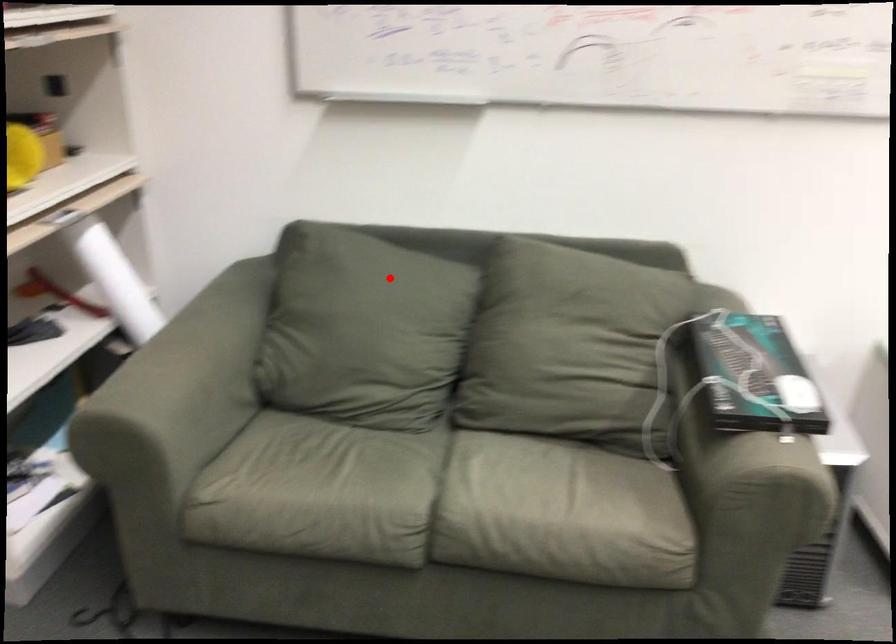
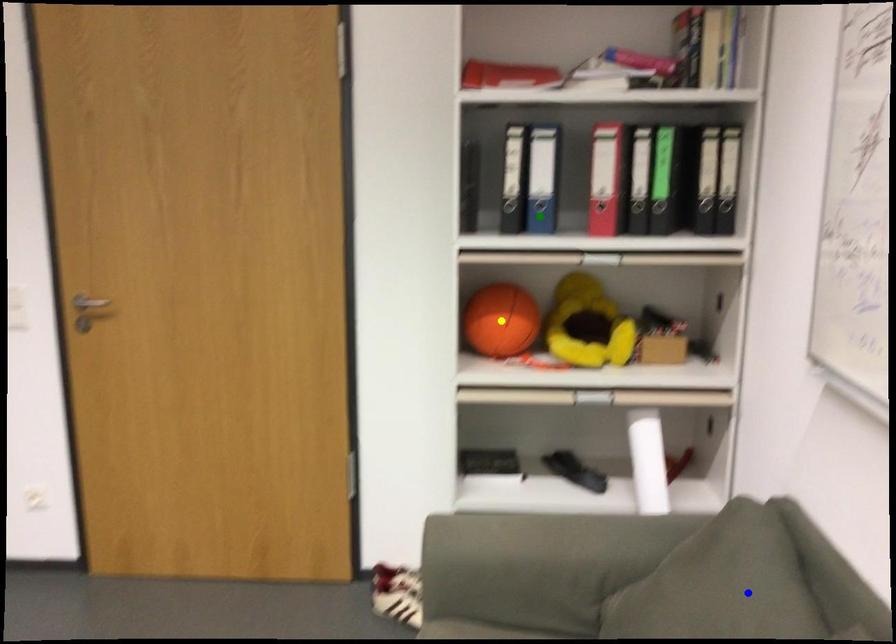
Question: I am providing you with two images of the same scene from different viewpoints. A red point is marked on the first image. You are given multiple points on the second image. Can you choose the point in image 2 that corresponds to the point in image 1?

Choices:
 (A) green point
 (B) blue point
 (C) yellow point

Answer: (B)